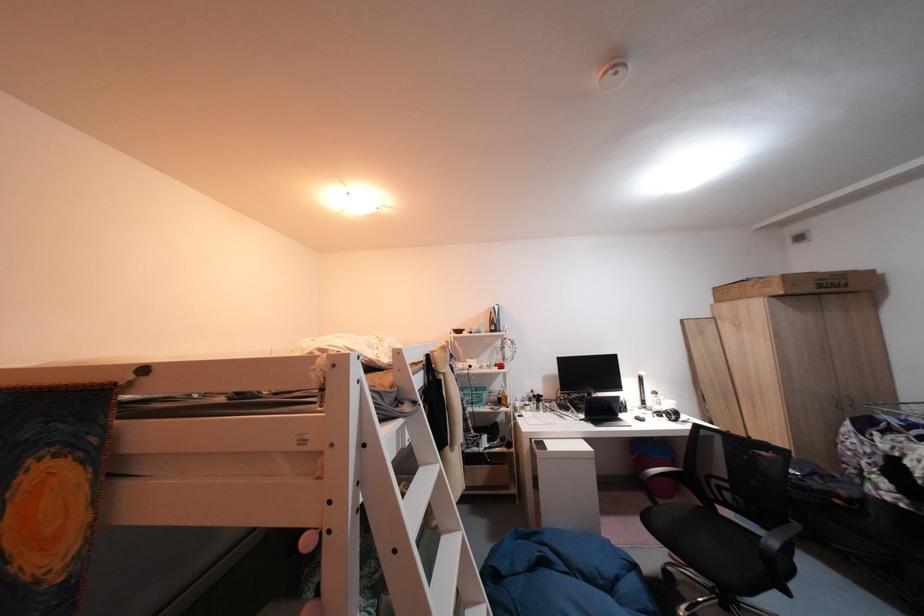
The height and width of the screenshot is (616, 924). In order to click on light blue basket in this screenshot , I will do `click(473, 395)`.